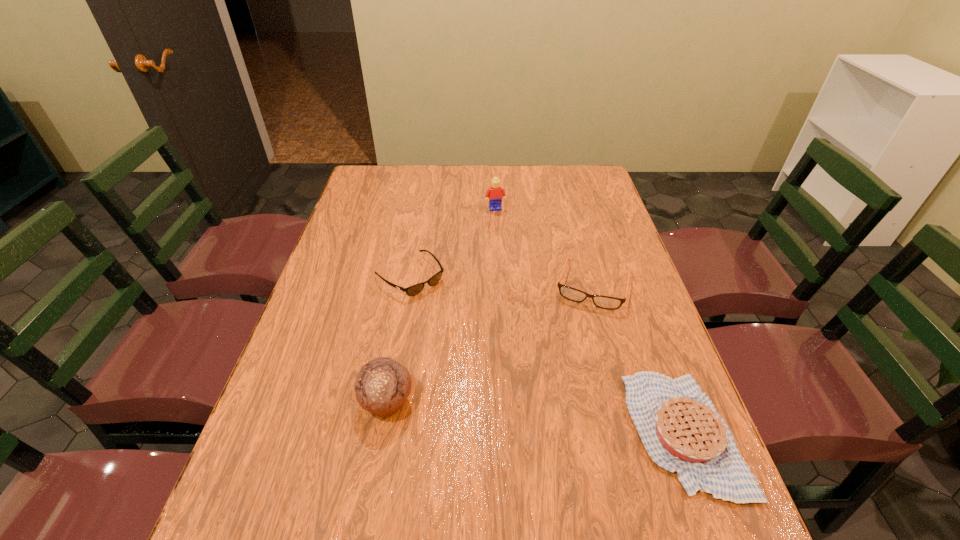
The width and height of the screenshot is (960, 540). I want to click on vacant area that lies between the sunglasses and the muffin, so click(x=398, y=339).

This screenshot has width=960, height=540. Identify the location of vacant region between the muffin and the spectacles. (491, 343).

Find the location of a particular element. This screenshot has height=540, width=960. vacant space that's between the spectacles and the pie is located at coordinates (638, 358).

You are a GUI agent. You are given a task and a screenshot of the screen. Output one action in this format:
    pyautogui.click(x=<x>, y=<y>)
    Task: Click on the vacant space that is in between the sunglasses and the pie
    
    Given the screenshot: What is the action you would take?
    pyautogui.click(x=546, y=354)

Locate an element on the screen. The image size is (960, 540). vacant region between the sunglasses and the farthest object is located at coordinates (453, 242).

Locate an element on the screen. The image size is (960, 540). free space between the spectacles and the muffin is located at coordinates (491, 343).

Select which object appears as the closest to the pie. Please provide its 2D coordinates. Your answer should be formatted as a tuple, i.e. [(x, y)], where the tuple contains the x and y coordinates of a point satisfying the conditions above.

[(605, 302)]

Find the location of a particular element. The height and width of the screenshot is (540, 960). object that is the third closest to the Lego is located at coordinates (382, 385).

Find the location of a particular element. This screenshot has height=540, width=960. free spot that satisfies the following two spatial constraints: 1. on the front side of the Lego; 2. on the right side of the spectacles is located at coordinates (499, 284).

Identify the location of free space that satisfies the following two spatial constraints: 1. on the front side of the pie; 2. on the left side of the spectacles. This screenshot has width=960, height=540. (635, 432).